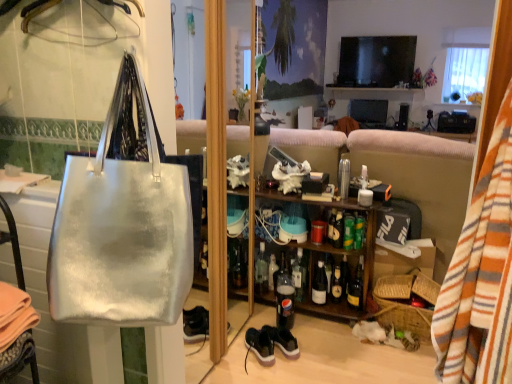
Question: Is there a large distance between matte cardboard box at lower right and clear glass bottle at center, which is counted as the first bottle, starting from the left?

Choices:
 (A) yes
 (B) no

Answer: (B)

Question: Would you say clear glass bottle at center, which is the 8th bottle in right-to-left order, is part of matte cardboard box at lower right's contents?

Choices:
 (A) no
 (B) yes

Answer: (A)

Question: From a real-world perspective, is matte cardboard box at lower right on clear glass bottle at center, which is counted as the first bottle, starting from the left?

Choices:
 (A) no
 (B) yes

Answer: (B)

Question: Can you confirm if matte cardboard box at lower right is shorter than clear glass bottle at center, which is counted as the first bottle, starting from the left?

Choices:
 (A) yes
 (B) no

Answer: (A)

Question: Does matte cardboard box at lower right have a greater width compared to clear glass bottle at center, which is the 8th bottle in right-to-left order?

Choices:
 (A) yes
 (B) no

Answer: (B)

Question: From the image's perspective, is shiny gold bottle at center, which is the 8th bottle in left-to-right order, located above or below brown woven picnic basket at lower right?

Choices:
 (A) above
 (B) below

Answer: (A)

Question: Is shiny gold bottle at center, which is the 8th bottle in left-to-right order, in front of or behind brown woven picnic basket at lower right in the image?

Choices:
 (A) behind
 (B) front

Answer: (A)

Question: Considering the positions of shiny gold bottle at center, which is the 8th bottle in left-to-right order, and brown woven picnic basket at lower right in the image, is shiny gold bottle at center, which is the 8th bottle in left-to-right order, wider or thinner than brown woven picnic basket at lower right?

Choices:
 (A) thin
 (B) wide

Answer: (A)

Question: Does point (356, 291) appear closer or farther from the camera than point (417, 291)?

Choices:
 (A) closer
 (B) farther

Answer: (B)

Question: Is point (288, 317) positioned closer to the camera than point (256, 355)?

Choices:
 (A) farther
 (B) closer

Answer: (A)

Question: From the image's perspective, relative to black suede sneakers at lower center, which is counted as the second sneakers, starting from the right, is translucent plastic soda bottle at center, which is counted as the third bottle, starting from the left, above or below?

Choices:
 (A) above
 (B) below

Answer: (A)

Question: Considering the positions of translucent plastic soda bottle at center, which is counted as the third bottle, starting from the left, and black suede sneakers at lower center, which is counted as the second sneakers, starting from the right, in the image, is translucent plastic soda bottle at center, which is counted as the third bottle, starting from the left, wider or thinner than black suede sneakers at lower center, which is counted as the second sneakers, starting from the right,?

Choices:
 (A) wide
 (B) thin

Answer: (B)

Question: Based on their positions, is translucent plastic soda bottle at center, the 6th bottle from the right, located to the left or right of black suede sneakers at lower center, which is counted as the 1th sneakers, starting from the left?

Choices:
 (A) left
 (B) right

Answer: (B)

Question: Do you think metallic silver cup at center is within wooden shelf at center, or outside of it?

Choices:
 (A) inside
 (B) outside

Answer: (B)

Question: From a real-world perspective, is metallic silver cup at center positioned above or below wooden shelf at center?

Choices:
 (A) above
 (B) below

Answer: (B)